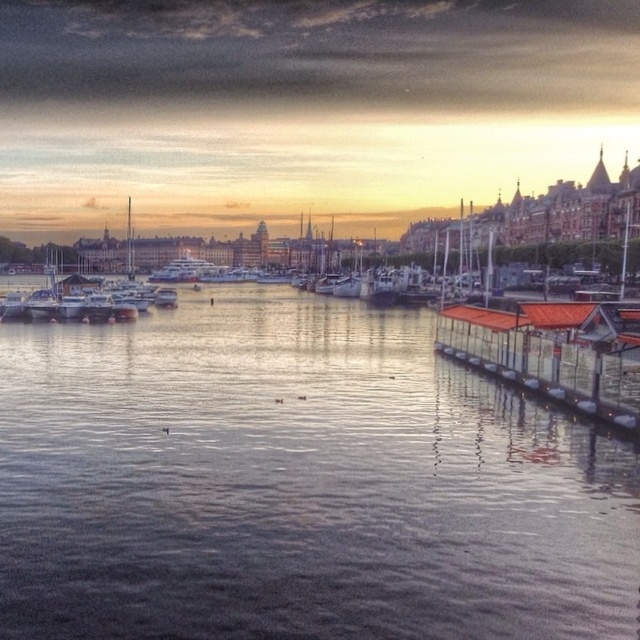
Question: Which object appears closest to the camera in this image?

Choices:
 (A) smooth water at center
 (B) orange corrugated metal dock at lower right

Answer: (A)

Question: Is smooth water at center bigger than orange corrugated metal dock at lower right?

Choices:
 (A) yes
 (B) no

Answer: (A)

Question: Does smooth water at center come behind orange corrugated metal dock at lower right?

Choices:
 (A) no
 (B) yes

Answer: (A)

Question: From the image, what is the correct spatial relationship of smooth water at center in relation to orange corrugated metal dock at lower right?

Choices:
 (A) above
 (B) below

Answer: (B)